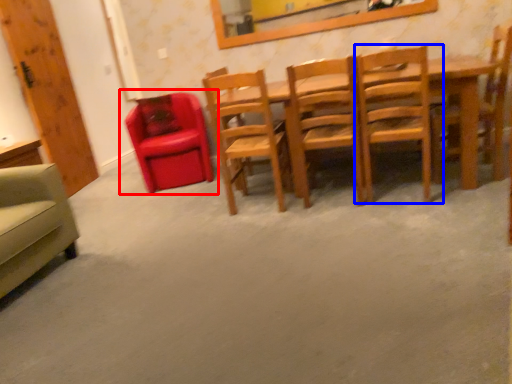
Question: Which object appears farthest to the camera in this image, chair (highlighted by a red box) or chair (highlighted by a blue box)?

Choices:
 (A) chair
 (B) chair

Answer: (A)